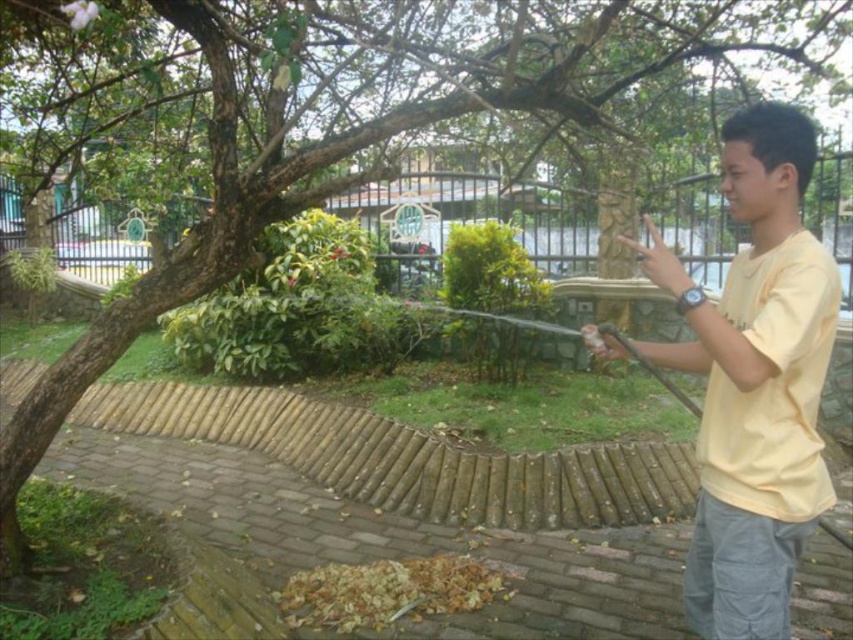
Can you confirm if yellow cotton shirt at right is bigger than black metal fence at upper center?

Yes.

From the picture: Does yellow cotton shirt at right have a lesser height compared to black metal fence at upper center?

Incorrect, yellow cotton shirt at right's height does not fall short of black metal fence at upper center's.

The height and width of the screenshot is (640, 853). Describe the element at coordinates (753, 380) in the screenshot. I see `yellow cotton shirt at right` at that location.

Image resolution: width=853 pixels, height=640 pixels. What are the coordinates of `yellow cotton shirt at right` in the screenshot? It's located at (753, 380).